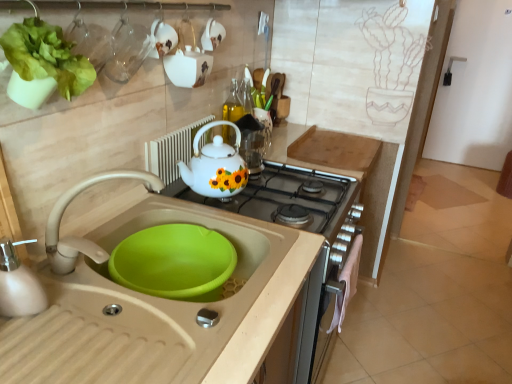
Find the location of a particular element. The height and width of the screenshot is (384, 512). vacant space to the right of white matte soap dispenser at left is located at coordinates (98, 319).